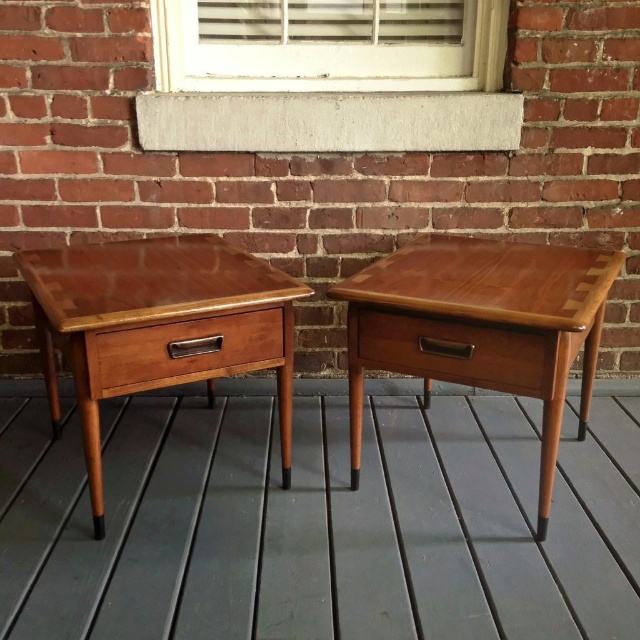
You are standing on the teak wood deck at center and want to place a potted plant on the mahogany wood side table at center. Based on their positions, can you safely place the plant on the table without it falling off?

The teak wood deck at center is positioned under the mahogany wood side table at center, so placing the potted plant on the table should be safe as the table is elevated and the deck supports it from below.

You are a furniture inspector checking the placement of items on the deck. You notice the mahogany wood table at left and the wooden drawer at left. According to safety guidelines, the table must be placed above the drawer to prevent items from falling off. Is the current arrangement compliant with the guidelines?

Yes, the current arrangement is compliant because the mahogany wood table at left is above the wooden drawer at left, meeting the safety requirement to prevent items from falling off.